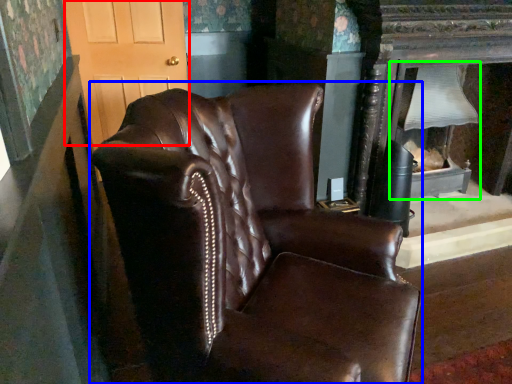
Question: Estimate the real-world distances between objects in this image. Which object is farther from glass door (highlighted by a red box), chair (highlighted by a blue box) or fireplace (highlighted by a green box)?

Choices:
 (A) chair
 (B) fireplace

Answer: (A)